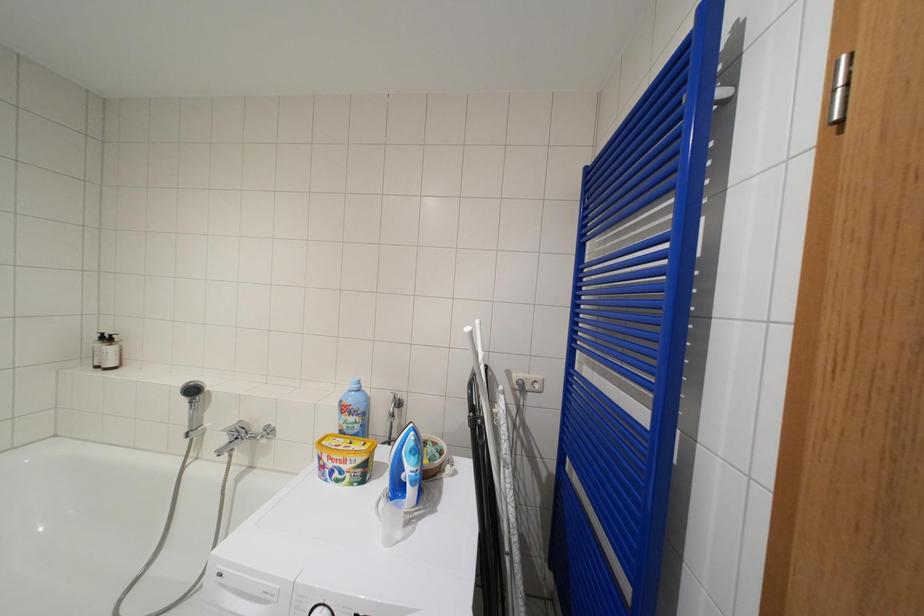
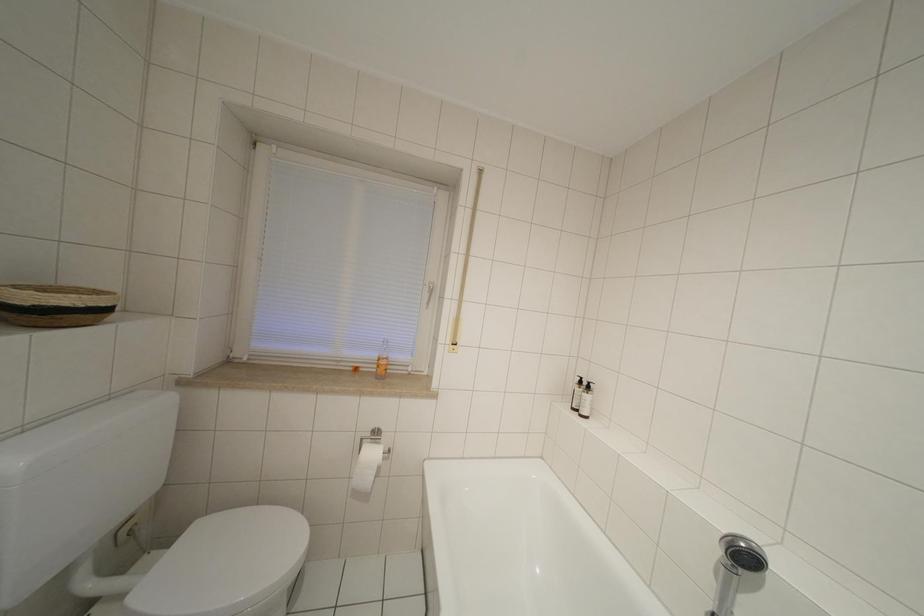
Question: The first image is from the beginning of the video and the second image is from the end. How did the camera likely rotate when shooting the video?

Choices:
 (A) Left
 (B) Right
 (C) Up
 (D) Down

Answer: (A)